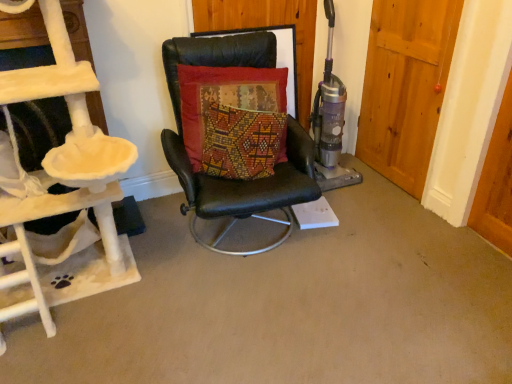
At what (x,y) coordinates should I click in order to perform the action: click on free point below black leather chair at center (from a real-world perspective). Please return your answer as a coordinate pair (x, y). Looking at the image, I should click on (252, 235).